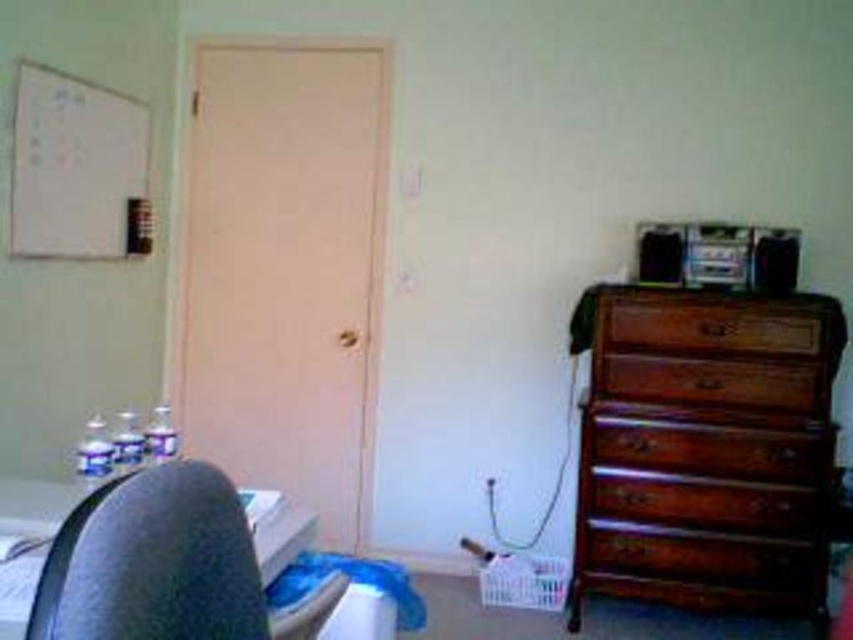
Can you confirm if wooden dresser at right is positioned above wooden drawer at right?

No, wooden dresser at right is not above wooden drawer at right.

Is point (592, 404) closer to viewer compared to point (801, 353)?

No, (592, 404) is behind (801, 353).

Where is `wooden dresser at right`? This screenshot has height=640, width=853. wooden dresser at right is located at coordinates (705, 449).

Does brown wood drawer at right have a lesser height compared to wooden drawer at right?

Incorrect, brown wood drawer at right's height does not fall short of wooden drawer at right's.

Based on the photo, is brown wood drawer at right in front of wooden drawer at right?

Yes, brown wood drawer at right is closer to the viewer.

Is point (604, 369) closer to camera compared to point (796, 340)?

No, (604, 369) is behind (796, 340).

You are a GUI agent. You are given a task and a screenshot of the screen. Output one action in this format:
    pyautogui.click(x=<x>, y=<y>)
    Task: Click on the brown wood drawer at right
    This screenshot has height=640, width=853.
    Given the screenshot: What is the action you would take?
    pyautogui.click(x=712, y=381)

Is matte black swivel chair at left positioned before wooden drawer at right?

Yes, it is in front of wooden drawer at right.

Which is behind, point (73, 557) or point (798, 348)?

Point (798, 348)

Locate an element on the screen. Image resolution: width=853 pixels, height=640 pixels. matte black swivel chair at left is located at coordinates (152, 561).